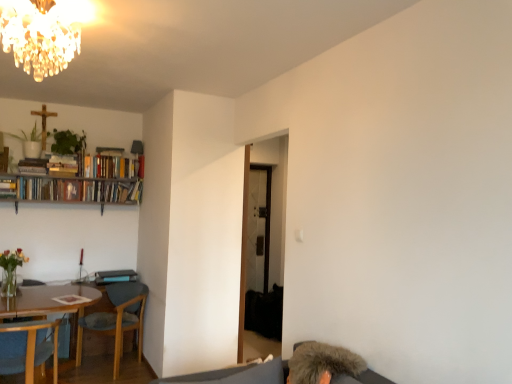
Question: Is green matte plant at upper left, the 1th plant in the left-to-right sequence, to the left or to the right of wooden chair at lower left, the 1th chair when ordered from back to front, in the image?

Choices:
 (A) left
 (B) right

Answer: (A)

Question: Considering their positions, is green matte plant at upper left, arranged as the second plant when viewed from the right, located in front of or behind wooden chair at lower left, the second chair when ordered from front to back?

Choices:
 (A) front
 (B) behind

Answer: (B)

Question: Estimate the real-world distances between objects in this image. Which object is farther from the hardcover books at upper left, the 2th book in the left-to-right sequence?

Choices:
 (A) green leafy plant at upper left, the 1th plant positioned from the right
 (B) hardcover book at left, arranged as the first book when viewed from the left
 (C) green matte plant at upper left, the 1th plant in the left-to-right sequence
 (D) fuzzy gray hair at lower right
 (E) green matte vase at lower left

Answer: (D)

Question: Based on their relative distances, which object is farther from the green leafy plant at upper left, which ranks as the 2th plant in left-to-right order?

Choices:
 (A) hardcover book at left, marked as the 2th book in a right-to-left arrangement
 (B) fuzzy gray hair at lower right
 (C) green matte vase at lower left
 (D) wooden chair at lower left, placed as the second chair when sorted from back to front
 (E) green matte plant at upper left, the 1th plant in the left-to-right sequence

Answer: (B)